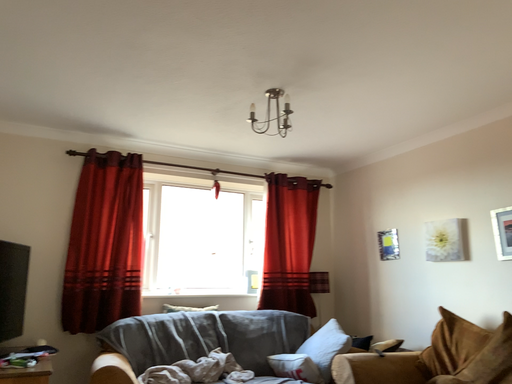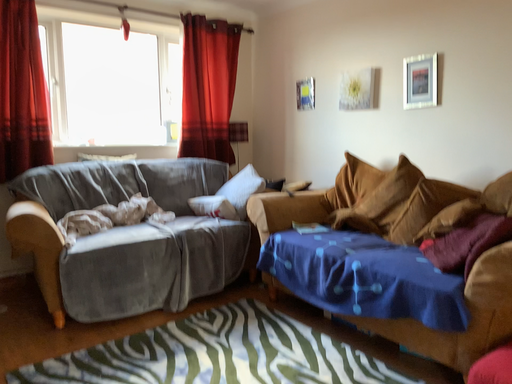
Question: How did the camera likely rotate when shooting the video?

Choices:
 (A) rotated upward
 (B) rotated downward

Answer: (B)